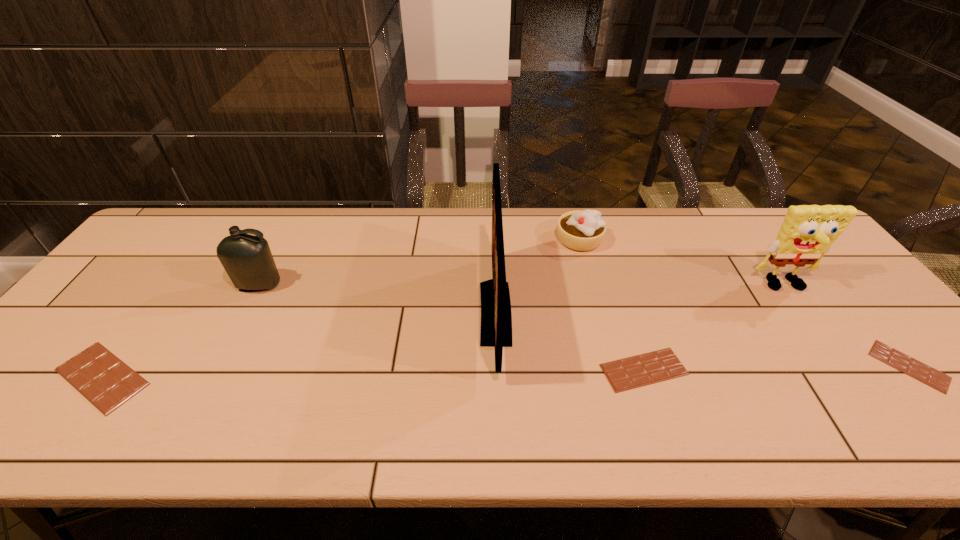
You are a GUI agent. You are given a task and a screenshot of the screen. Output one action in this format:
    pyautogui.click(x=<x>, y=<y>)
    Task: Click on the monitor that is at the near edge
    The height and width of the screenshot is (540, 960).
    Given the screenshot: What is the action you would take?
    pyautogui.click(x=496, y=318)

Locate an element on the screen. object present at the left edge is located at coordinates (102, 378).

The image size is (960, 540). In order to click on object positioned at the right edge in this screenshot , I will do `click(808, 231)`.

The width and height of the screenshot is (960, 540). Find the location of `object located at the near left corner`. object located at the near left corner is located at coordinates (102, 378).

In the image, there is a desktop. What are the coordinates of `vacant space at the far edge` in the screenshot? It's located at (396, 211).

The image size is (960, 540). I want to click on vacant space at the near edge of the desktop, so click(x=848, y=389).

The image size is (960, 540). I want to click on vacant space at the left edge of the desktop, so click(x=109, y=290).

This screenshot has height=540, width=960. In order to click on vacant space at the right edge of the desktop in this screenshot , I will do `click(824, 305)`.

The width and height of the screenshot is (960, 540). In order to click on free space between the tallest object and the second tallest chocolate bar in this screenshot , I will do `click(569, 341)`.

The image size is (960, 540). Find the location of `free space between the tallest object and the sponge`. free space between the tallest object and the sponge is located at coordinates (640, 299).